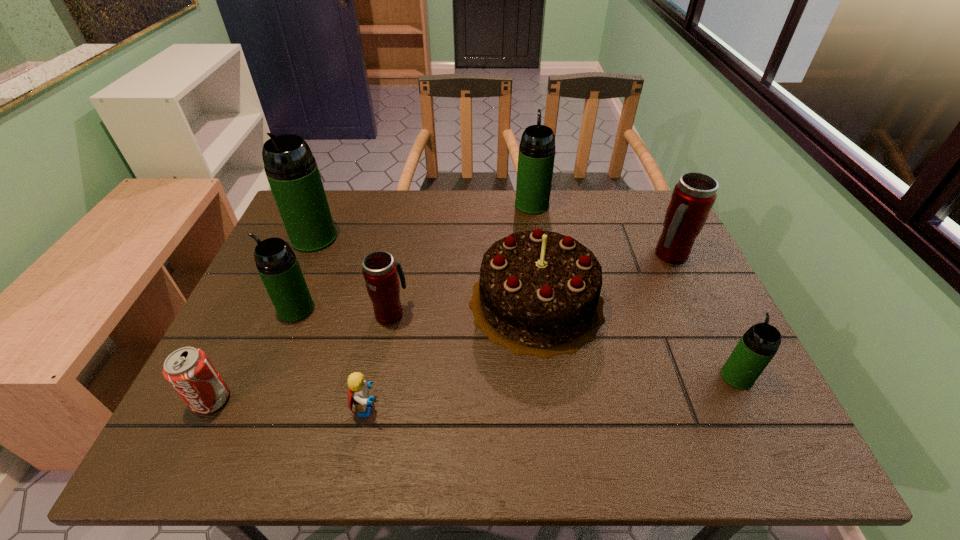
Find the location of a particular element. free spot between the farthest thermos bottle and the smaller red thermos bottle is located at coordinates (462, 259).

Where is `free space between the smaller red thermos bottle and the Lego`? This screenshot has width=960, height=540. free space between the smaller red thermos bottle and the Lego is located at coordinates (379, 360).

Find the location of a particular element. vacant area that lies between the farther red thermos bottle and the brown birthday cake is located at coordinates (604, 279).

You are a GUI agent. You are given a task and a screenshot of the screen. Output one action in this format:
    pyautogui.click(x=<x>, y=<y>)
    Task: Click on the fourth closest object relative to the second tallest thermos bottle
    The width and height of the screenshot is (960, 540).
    Given the screenshot: What is the action you would take?
    pyautogui.click(x=292, y=172)

Find the location of a particular element. This screenshot has height=540, width=960. object that stands as the closest to the rightmost green thermos bottle is located at coordinates (538, 294).

You are a GUI agent. You are given a task and a screenshot of the screen. Output one action in this format:
    pyautogui.click(x=<x>, y=<y>)
    Task: Click on the thermos bottle that is the third closest to the second farthest green thermos bottle
    The width and height of the screenshot is (960, 540).
    Given the screenshot: What is the action you would take?
    pyautogui.click(x=536, y=156)

Locate an element on the screen. This screenshot has width=960, height=540. the closest thermos bottle to the birthday cake is located at coordinates (380, 271).

Select which green thermos bottle is the closest to the third farthest green thermos bottle. Please provide its 2D coordinates. Your answer should be formatted as a tuple, i.e. [(x, y)], where the tuple contains the x and y coordinates of a point satisfying the conditions above.

[(292, 172)]

Select which green thermos bottle is the second closest to the birthday cake. Please provide its 2D coordinates. Your answer should be formatted as a tuple, i.e. [(x, y)], where the tuple contains the x and y coordinates of a point satisfying the conditions above.

[(759, 344)]

The image size is (960, 540). In order to click on free spot that satisfies the following two spatial constraints: 1. from the spout of the third biggest green thermos bottle; 2. from the spout of the rightmost green thermos bottle in this screenshot , I will do `click(269, 376)`.